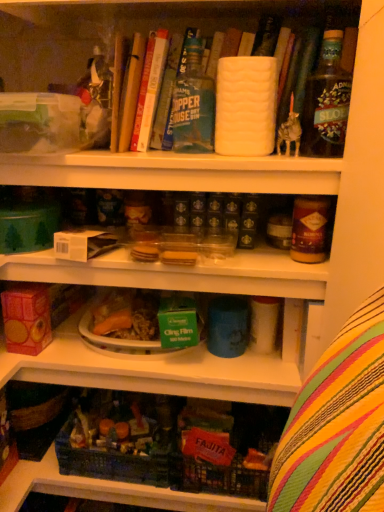
This screenshot has width=384, height=512. What do you see at coordinates (193, 103) in the screenshot?
I see `green matte bottle at upper center, which is the first bottle in left-to-right order` at bounding box center [193, 103].

This screenshot has width=384, height=512. What do you see at coordinates (167, 367) in the screenshot?
I see `translucent plastic container at center, the 2th shelf positioned from the top` at bounding box center [167, 367].

Image resolution: width=384 pixels, height=512 pixels. What are the coordinates of `hardcover book at upper center, which is the 3th book from right to left` in the screenshot? It's located at (131, 92).

The height and width of the screenshot is (512, 384). I want to click on matte brown jar at upper right, so click(337, 426).

What is the approximate width of translucent plastic bag at center?

translucent plastic bag at center is 7.90 inches in width.

What do you see at coordinates (127, 315) in the screenshot? The image size is (384, 512). I see `translucent plastic bag at center` at bounding box center [127, 315].

In the scene shown: Measure the distance between brown glass jar at upper right and camera.

brown glass jar at upper right is 84.92 centimeters from camera.

The width and height of the screenshot is (384, 512). In order to click on green glass bottle at upper right, which is the 1th bottle from right to left in this screenshot , I will do `click(326, 101)`.

Is hardcover book at upper center, which is the 3th book from right to left, turned away from translucent plastic container at center, the 2th shelf positioned from the top?

That's not correct — hardcover book at upper center, which is the 3th book from right to left, is not looking away from translucent plastic container at center, the 2th shelf positioned from the top.

From a real-world perspective, which is physically below, hardcover book at upper center, arranged as the first book when viewed from the left, or translucent plastic container at center, the 2th shelf positioned from the top?

In real-world perspective, translucent plastic container at center, the 2th shelf positioned from the top, is lower.

Is hardcover book at upper center, which is the 3th book from right to left, directly adjacent to translucent plastic container at center, the 2th shelf positioned from the top?

hardcover book at upper center, which is the 3th book from right to left, is not next to translucent plastic container at center, the 2th shelf positioned from the top, and they're not touching.

How many degrees apart are the facing directions of hardcover book at upper center, arranged as the first book when viewed from the left, and translucent plastic container at center, the 2th shelf positioned from the top?

The facing directions of hardcover book at upper center, arranged as the first book when viewed from the left, and translucent plastic container at center, the 2th shelf positioned from the top, are 5.4 degrees apart.

This screenshot has width=384, height=512. Find the location of `bottle below the green matte bottle at upper center, acting as the 2th bottle starting from the right (from the image's perspective)`. bottle below the green matte bottle at upper center, acting as the 2th bottle starting from the right (from the image's perspective) is located at coordinates (326, 101).

Would you consider green matte bottle at upper center, acting as the 2th bottle starting from the right, to be distant from green glass bottle at upper right, which is the 1th bottle from right to left?

That's not correct — green matte bottle at upper center, acting as the 2th bottle starting from the right, is a little close to green glass bottle at upper right, which is the 1th bottle from right to left.

Is point (182, 85) farther from camera compared to point (325, 156)?

Yes, it is.

Looking at this image, how many degrees apart are the facing directions of green matte bottle at upper center, which is the first bottle in left-to-right order, and green glass bottle at upper right, positioned as the 2th bottle in left-to-right order?

The angle between the facing direction of green matte bottle at upper center, which is the first bottle in left-to-right order, and the facing direction of green glass bottle at upper right, positioned as the 2th bottle in left-to-right order, is 1.88 degrees.

From a real-world perspective, is hardcover book at upper center, arranged as the first book when viewed from the left, physically below clear plastic container at center, which appears as the second shelf when ordered from the bottom?

No, from a real-world perspective, hardcover book at upper center, arranged as the first book when viewed from the left, is not below clear plastic container at center, which appears as the second shelf when ordered from the bottom.

The height and width of the screenshot is (512, 384). Identify the location of shelf lying on the right of hardcover book at upper center, which is the 3th book from right to left. [183, 175].

In terms of height, does green glass bottle at upper right, positioned as the 2th bottle in left-to-right order, look taller or shorter compared to matte brown jar at upper right?

Considering their sizes, green glass bottle at upper right, positioned as the 2th bottle in left-to-right order, has less height than matte brown jar at upper right.

From a real-world perspective, is green glass bottle at upper right, which is the 1th bottle from right to left, beneath matte brown jar at upper right?

No, from a real-world perspective, green glass bottle at upper right, which is the 1th bottle from right to left, is not under matte brown jar at upper right.

Who is smaller, green glass bottle at upper right, positioned as the 2th bottle in left-to-right order, or matte brown jar at upper right?

With smaller size is green glass bottle at upper right, positioned as the 2th bottle in left-to-right order.

Is green glass bottle at upper right, which is the 1th bottle from right to left, positioned with its back to matte brown jar at upper right?

That's not correct — green glass bottle at upper right, which is the 1th bottle from right to left, is not looking away from matte brown jar at upper right.

From the picture: Is green matte bottle at upper center, which is the first bottle in left-to-right order, shorter than hardcover book at upper center, which is the 3th book from left to right?

In fact, green matte bottle at upper center, which is the first bottle in left-to-right order, may be taller than hardcover book at upper center, which is the 3th book from left to right.

From the image's perspective, which is above, green matte bottle at upper center, which is the first bottle in left-to-right order, or hardcover book at upper center, the 1th book viewed from the right?

hardcover book at upper center, the 1th book viewed from the right.

Is green matte bottle at upper center, acting as the 2th bottle starting from the right, to the left of hardcover book at upper center, the 1th book viewed from the right, from the viewer's perspective?

Incorrect, green matte bottle at upper center, acting as the 2th bottle starting from the right, is not on the left side of hardcover book at upper center, the 1th book viewed from the right.

Between translucent plastic container at center, marked as the first shelf in a bottom-to-top arrangement, and clear plastic container at center, which appears as the first shelf when viewed from the top, which one appears on the right side from the viewer's perspective?

clear plastic container at center, which appears as the first shelf when viewed from the top, is more to the right.

Looking at this image, which is in front, translucent plastic container at center, marked as the first shelf in a bottom-to-top arrangement, or clear plastic container at center, which appears as the first shelf when viewed from the top?

clear plastic container at center, which appears as the first shelf when viewed from the top, is closer to the camera.

Looking at this image, how many degrees apart are the facing directions of translucent plastic container at center, the 2th shelf positioned from the top, and clear plastic container at center, which appears as the first shelf when viewed from the top?

The angle between the facing direction of translucent plastic container at center, the 2th shelf positioned from the top, and the facing direction of clear plastic container at center, which appears as the first shelf when viewed from the top, is 0.651 degrees.

Considering the sizes of objects translucent plastic container at center, marked as the first shelf in a bottom-to-top arrangement, and clear plastic container at center, which appears as the second shelf when ordered from the bottom, in the image provided, who is smaller, translucent plastic container at center, marked as the first shelf in a bottom-to-top arrangement, or clear plastic container at center, which appears as the second shelf when ordered from the bottom,?

clear plastic container at center, which appears as the second shelf when ordered from the bottom.

Considering the positions of objects hardcover book at upper center, which is the second book from left to right, and translucent plastic container at center, marked as the first shelf in a bottom-to-top arrangement, in the image provided, who is in front, hardcover book at upper center, which is the second book from left to right, or translucent plastic container at center, marked as the first shelf in a bottom-to-top arrangement,?

hardcover book at upper center, which is the second book from left to right, is more forward.

Find the location of a particular element. This screenshot has width=384, height=512. book that is the 2nd one above the translucent plastic container at center, marked as the first shelf in a bottom-to-top arrangement (from a real-world perspective) is located at coordinates (149, 89).

Can you confirm if hardcover book at upper center, the second book from the right, is bigger than translucent plastic container at center, marked as the first shelf in a bottom-to-top arrangement?

Incorrect, hardcover book at upper center, the second book from the right, is not larger than translucent plastic container at center, marked as the first shelf in a bottom-to-top arrangement.

Considering the relative positions of hardcover book at upper center, which is the second book from left to right, and translucent plastic container at center, marked as the first shelf in a bottom-to-top arrangement, in the image provided, is hardcover book at upper center, which is the second book from left to right, to the left of translucent plastic container at center, marked as the first shelf in a bottom-to-top arrangement, from the viewer's perspective?

No.

Locate an element on the screen. This screenshot has width=384, height=512. the 2nd book in front of the translucent plastic container at center, the 2th shelf positioned from the top, counting from the anchor's position is located at coordinates (131, 92).

I want to click on bottle beneath the green glass bottle at upper right, positioned as the 2th bottle in left-to-right order (from a real-world perspective), so click(x=193, y=103).

Estimate the real-world distances between objects in this image. Which object is further from translucent plastic bag at center, hardcover book at upper center, which is the 3th book from right to left, or brown glass jar at upper right?

hardcover book at upper center, which is the 3th book from right to left, lies further to translucent plastic bag at center than the other object.

Considering their positions, is hardcover book at upper center, the 1th book viewed from the right, positioned closer to clear plastic container at center, which appears as the second shelf when ordered from the bottom, than hardcover book at upper center, which is the 3th book from right to left?

hardcover book at upper center, which is the 3th book from right to left, lies closer to clear plastic container at center, which appears as the second shelf when ordered from the bottom, than the other object.

Which object lies further to the anchor point translucent plastic container at center, the 2th shelf positioned from the top, brown glass jar at upper right or clear plastic container at center, which appears as the first shelf when viewed from the top?

brown glass jar at upper right is further to translucent plastic container at center, the 2th shelf positioned from the top.

From the image, which object appears to be nearer to hardcover book at upper center, the second book from the right, hardcover book at upper center, arranged as the first book when viewed from the left, or green glass bottle at upper right, positioned as the 2th bottle in left-to-right order?

hardcover book at upper center, arranged as the first book when viewed from the left.

From the image, which object appears to be nearer to translucent plastic container at center, marked as the first shelf in a bottom-to-top arrangement, translucent plastic bag at center or clear plastic container at center, which appears as the second shelf when ordered from the bottom?

translucent plastic bag at center is positioned closer to the anchor translucent plastic container at center, marked as the first shelf in a bottom-to-top arrangement.

Based on their spatial positions, is translucent plastic container at center, the 2th shelf positioned from the top, or green glass bottle at upper right, positioned as the 2th bottle in left-to-right order, closer to hardcover book at upper center, which is the second book from left to right?

Among the two, green glass bottle at upper right, positioned as the 2th bottle in left-to-right order, is located nearer to hardcover book at upper center, which is the second book from left to right.

When comparing their distances from green glass bottle at upper right, positioned as the 2th bottle in left-to-right order, does brown glass jar at upper right or clear plastic container at center, which appears as the second shelf when ordered from the bottom, seem closer?

The object closer to green glass bottle at upper right, positioned as the 2th bottle in left-to-right order, is brown glass jar at upper right.

When comparing their distances from translucent plastic bag at center, does hardcover book at upper center, the 1th book viewed from the right, or matte brown jar at upper right seem closer?

Among the two, hardcover book at upper center, the 1th book viewed from the right, is located nearer to translucent plastic bag at center.

What are the coordinates of `food between green glass bottle at upper right, which is the 1th bottle from right to left, and translucent plastic container at center, the 2th shelf positioned from the top, in the up-down direction` in the screenshot? It's located at (127, 315).

The width and height of the screenshot is (384, 512). Identify the location of food that lies between clear plastic container at center, which appears as the first shelf when viewed from the top, and translucent plastic container at center, marked as the first shelf in a bottom-to-top arrangement, from top to bottom. (127, 315).

What are the coordinates of `shelf located between translucent plastic bag at center and green glass bottle at upper right, which is the 1th bottle from right to left, in the left-right direction` in the screenshot? It's located at (183, 175).

Find the location of a particular element. The height and width of the screenshot is (512, 384). bottle between hardcover book at upper center, arranged as the first book when viewed from the left, and brown glass jar at upper right is located at coordinates (193, 103).